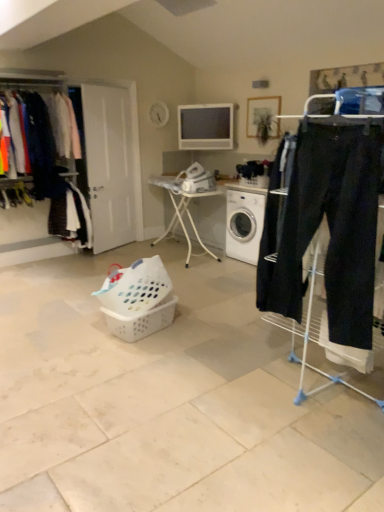
Question: In the image, is matte black pants at left, the 2th clothing from the bottom, on the left side or the right side of dark blue fabric pants at left, marked as the first clothing in a bottom-to-top arrangement?

Choices:
 (A) right
 (B) left

Answer: (B)

Question: Does point (39, 136) appear closer or farther from the camera than point (69, 202)?

Choices:
 (A) farther
 (B) closer

Answer: (B)

Question: Estimate the real-world distances between objects in this image. Which object is closer to the white plastic table at center?

Choices:
 (A) white plastic washing machine at center
 (B) dark blue fabric pants at left, the 2th clothing viewed from the top
 (C) matte black clothes at left
 (D) white plastic laundry basket at center, positioned as the first basket in top-to-bottom order
 (E) white plastic basket at center, which is the 2th basket from top to bottom

Answer: (A)

Question: Based on their relative distances, which object is farther from the white plastic washing machine at center?

Choices:
 (A) matte black clothes at left
 (B) matte black pants at left, which appears as the first clothing when viewed from the top
 (C) dark blue fabric pants at left, the 2th clothing viewed from the top
 (D) white plastic table at center
 (E) white plastic laundry basket at center, positioned as the 2th basket in bottom-to-top order

Answer: (B)